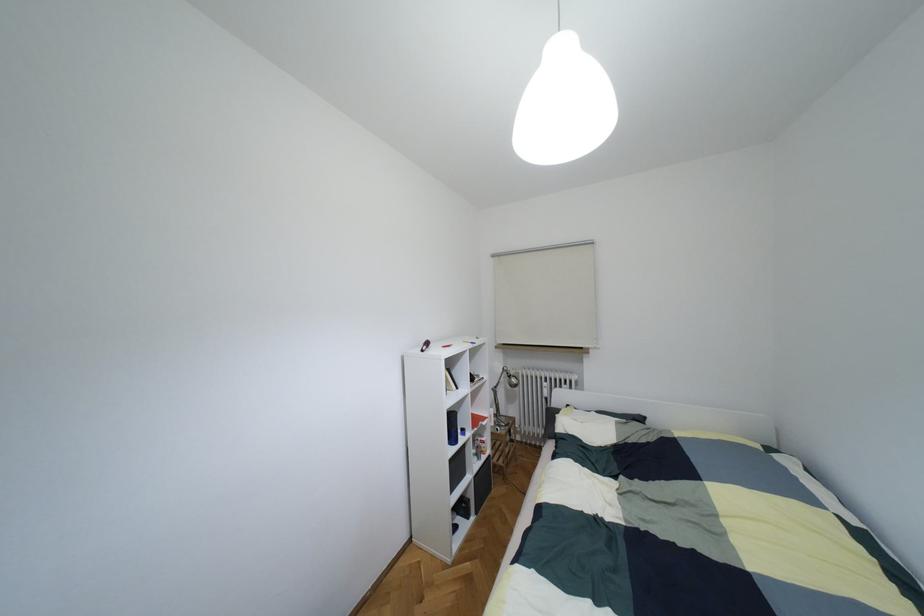
Find where to adjust the silver lamp head. Please return your answer as a coordinate pair (x, y).

(512, 377)